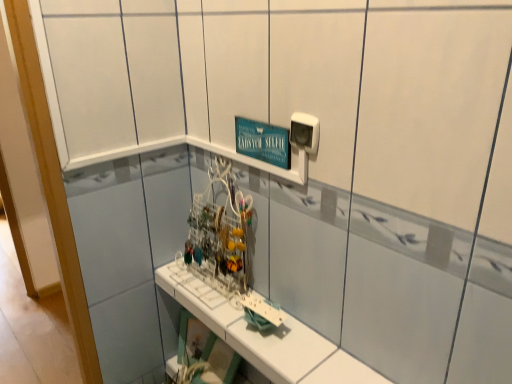
Question: Does white plastic electric outlet at upper right have a lesser height compared to white plastic shelf at center?

Choices:
 (A) yes
 (B) no

Answer: (B)

Question: Is white plastic electric outlet at upper right looking in the opposite direction of white plastic shelf at center?

Choices:
 (A) no
 (B) yes

Answer: (A)

Question: Is white plastic electric outlet at upper right in contact with white plastic shelf at center?

Choices:
 (A) no
 (B) yes

Answer: (A)

Question: Can you confirm if white plastic electric outlet at upper right is thinner than white plastic shelf at center?

Choices:
 (A) yes
 (B) no

Answer: (A)

Question: Is white plastic electric outlet at upper right wider than white plastic shelf at center?

Choices:
 (A) no
 (B) yes

Answer: (A)

Question: From a real-world perspective, is white plastic electric outlet at upper right positioned over white plastic shelf at center based on gravity?

Choices:
 (A) yes
 (B) no

Answer: (A)

Question: From a real-world perspective, is white plastic shelf at center beneath white plastic electric outlet at upper right?

Choices:
 (A) yes
 (B) no

Answer: (A)

Question: Is white plastic shelf at center facing away from white plastic electric outlet at upper right?

Choices:
 (A) yes
 (B) no

Answer: (B)

Question: Can you confirm if white plastic shelf at center is taller than white plastic electric outlet at upper right?

Choices:
 (A) no
 (B) yes

Answer: (A)

Question: Is the position of white plastic shelf at center more distant than that of white plastic electric outlet at upper right?

Choices:
 (A) no
 (B) yes

Answer: (A)

Question: Can you confirm if white plastic shelf at center is thinner than white plastic electric outlet at upper right?

Choices:
 (A) yes
 (B) no

Answer: (B)

Question: From the image's perspective, is white plastic shelf at center below white plastic electric outlet at upper right?

Choices:
 (A) yes
 (B) no

Answer: (A)

Question: Based on their positions, is white plastic electric outlet at upper right located to the left or right of white plastic shelf at center?

Choices:
 (A) right
 (B) left

Answer: (A)